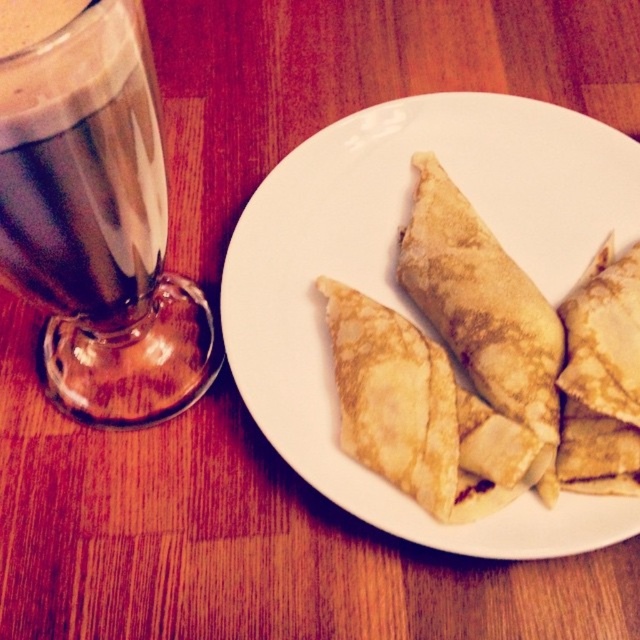
The width and height of the screenshot is (640, 640). Describe the element at coordinates (401, 296) in the screenshot. I see `golden-brown crepes at center` at that location.

Which is more to the left, golden-brown crepes at center or dark brown liquid at left?

From the viewer's perspective, dark brown liquid at left appears more on the left side.

Is point (579, 118) behind point (19, 150)?

Yes, it is.

Where is `golden-brown crepes at center`? golden-brown crepes at center is located at coordinates (401, 296).